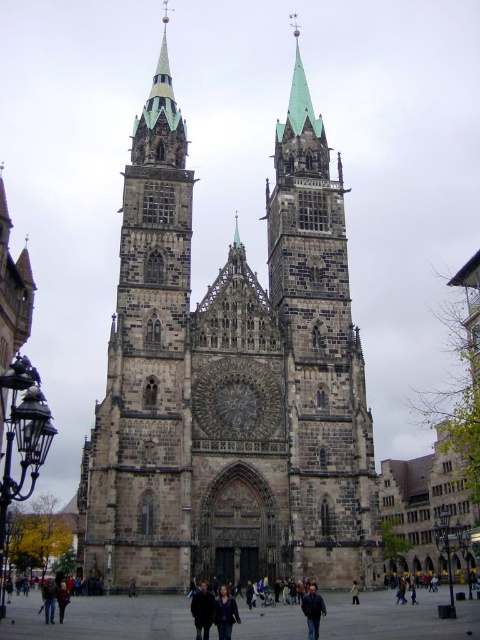
You are standing in front of the cathedral and see the dark brown leather jacket at lower center and the yellow fabric person at center. Which object is closer to you?

The dark brown leather jacket at lower center is closer to you because it is in front of the yellow fabric person at center.

You are a visitor standing at the entrance of the cathedral and want to place your dark brown leather coat at center on the dark brown stone clock at center. Will the coat fit on the clock?

The dark brown stone clock at center is wider than the dark brown leather coat at center, so the coat will fit on the clock.

You are standing in front of the grand Gothic cathedral. You want to locate the dark brown stone clock at center. Where should you look relative to the cathedral facade?

The dark brown stone clock at center is located at the central area of the cathedral facade, positioned at coordinates approximately 0.625 on the horizontal axis and 0.494 on the vertical axis.